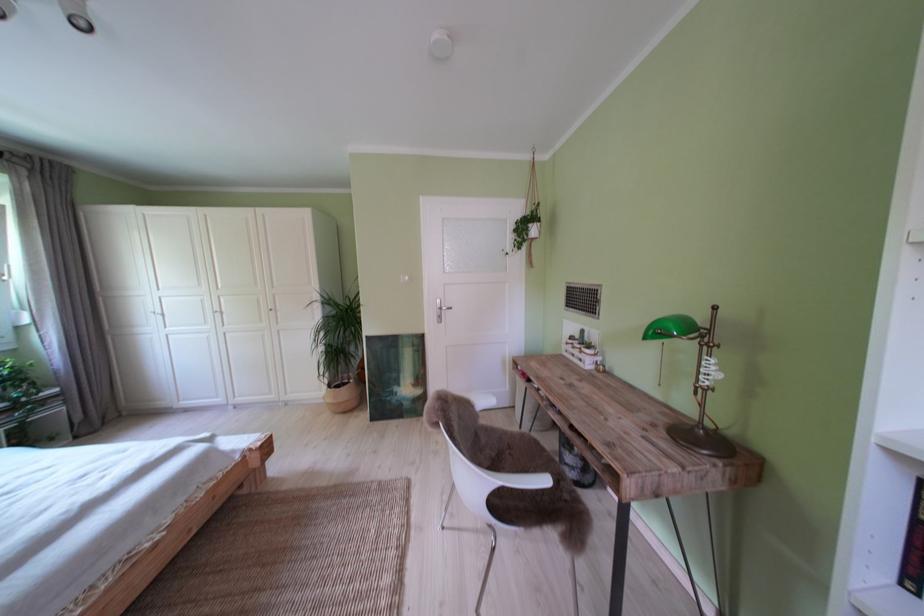
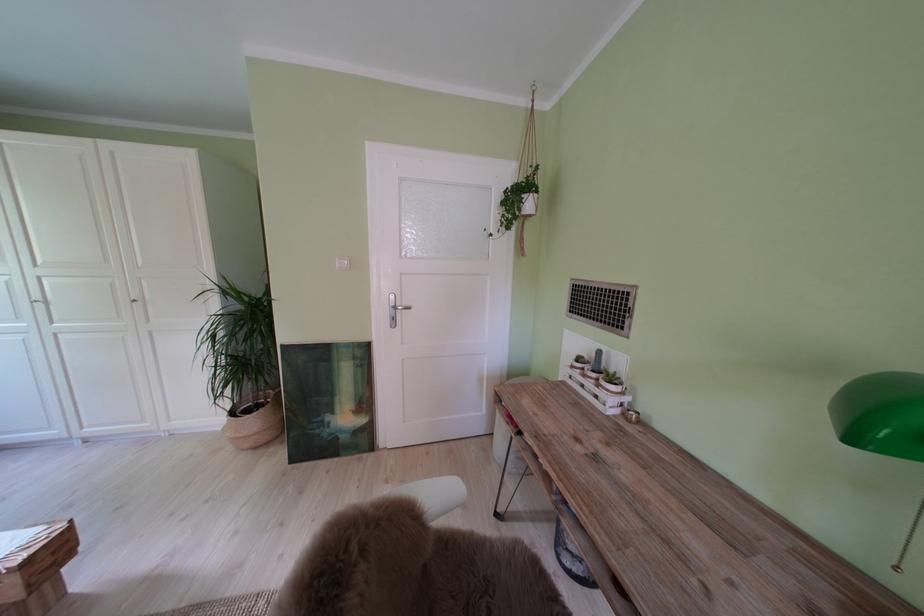
Find the pixel in the second image that matches point 399,403 in the first image.

(329, 437)